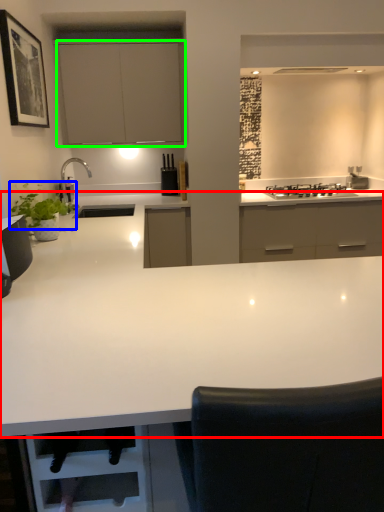
Question: Which object is positioned closest to countertop (highlighted by a red box)? Select from plant (highlighted by a blue box) and cabinetry (highlighted by a green box).

Choices:
 (A) plant
 (B) cabinetry

Answer: (A)